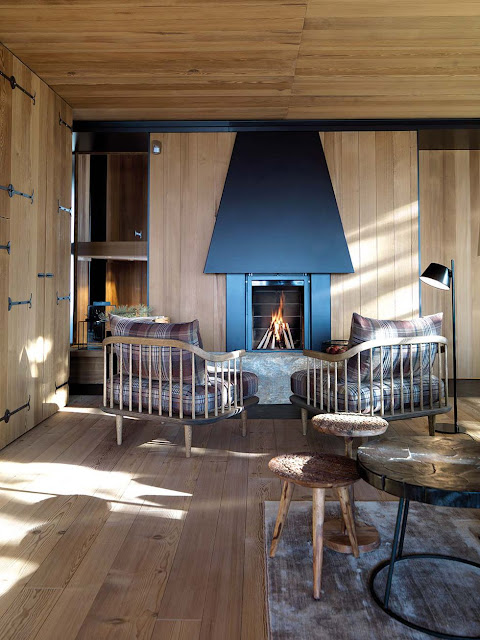
You are a GUI agent. You are given a task and a screenshot of the screen. Output one action in this format:
    pyautogui.click(x=<x>, y=<y>)
    Task: Click on the place to sit around fire
    The image size is (480, 640).
    Given the screenshot: What is the action you would take?
    pyautogui.click(x=198, y=377), pyautogui.click(x=342, y=374)